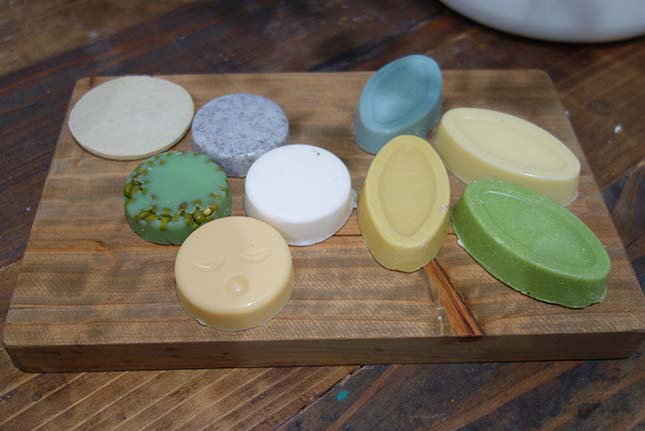
I want to click on wooden block, so click(129, 281).